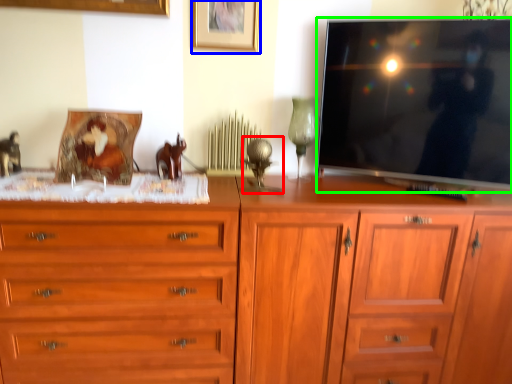
Question: Based on their relative distances, which object is nearer to table lamp (highlighted by a red box)? Choose from picture frame (highlighted by a blue box) and television (highlighted by a green box).

Choices:
 (A) picture frame
 (B) television

Answer: (A)